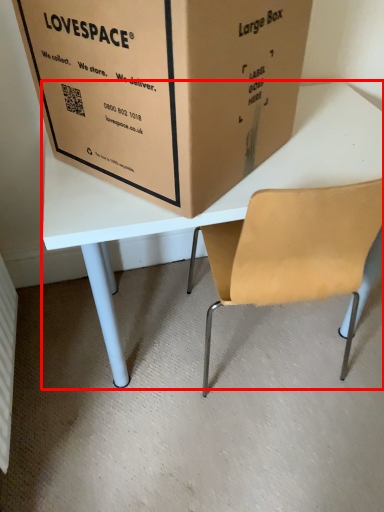
Question: From the image's perspective, where is table (annotated by the red box) located in relation to box in the image?

Choices:
 (A) below
 (B) above

Answer: (A)